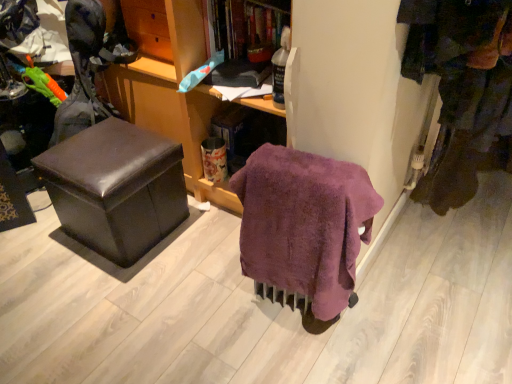
Identify the location of free point above shiny brown ottoman at left (from a real-world perspective). This screenshot has height=384, width=512. (110, 148).